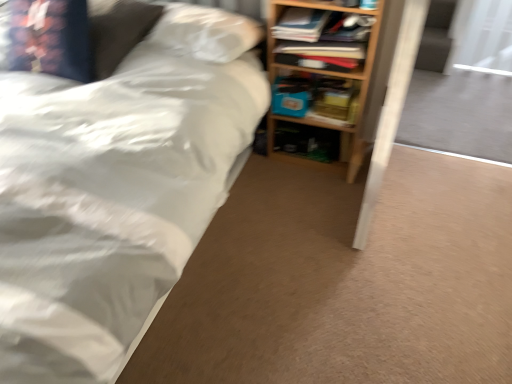
Question: From the image's perspective, is wooden bookshelf at upper right, the second book in the back-to-front sequence, located above or below white matte bed at upper left?

Choices:
 (A) below
 (B) above

Answer: (B)

Question: Considering their positions, is wooden bookshelf at upper right, the first book from the front, located in front of or behind white matte bed at upper left?

Choices:
 (A) behind
 (B) front

Answer: (A)

Question: Which of these objects is positioned closest to the blue matte paperback book at center?

Choices:
 (A) transparent plastic screen door at upper right
 (B) velvet-like floral pillow at upper left
 (C) wooden bookshelf at upper right, the first book from the front
 (D) wooden bookshelf at right
 (E) white matte bed at upper left

Answer: (D)

Question: Which object is the closest to the blue matte paperback book at center?

Choices:
 (A) wooden bookshelf at right
 (B) matte blue book at center, which ranks as the first book in back-to-front order
 (C) transparent plastic screen door at upper right
 (D) velvet-like floral pillow at upper left
 (E) wooden bookshelf at upper right, the second book in the back-to-front sequence

Answer: (B)